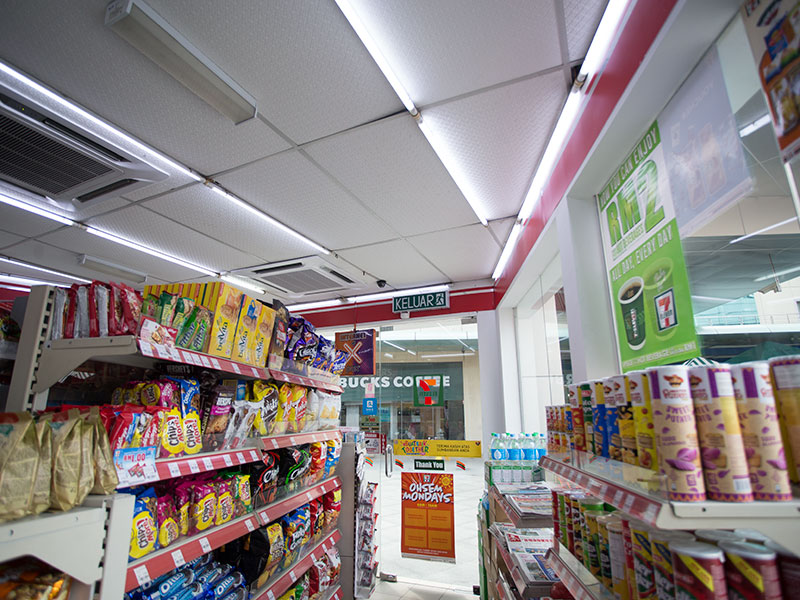
Where is `glass door`? glass door is located at coordinates (438, 348), (409, 409), (466, 496), (390, 525).